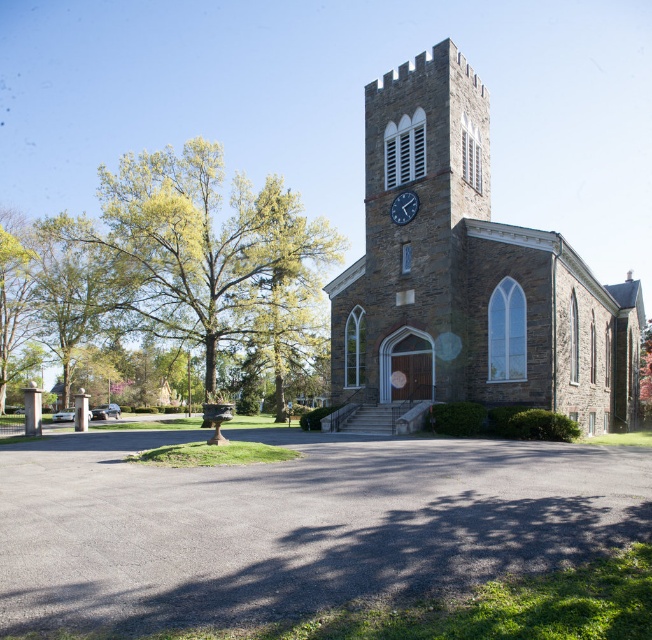
Is green leafy tree at left bigger than metallic clock at upper center?

Yes, green leafy tree at left is bigger than metallic clock at upper center.

Who is shorter, green leafy tree at left or metallic clock at upper center?

With less height is metallic clock at upper center.

The image size is (652, 640). Describe the element at coordinates (205, 253) in the screenshot. I see `green leafy tree at left` at that location.

Find the location of `green leafy tree at left`. green leafy tree at left is located at coordinates (205, 253).

Does stone church at center have a smaller size compared to green leafy tree at left?

Yes.

Is stone church at center shorter than green leafy tree at left?

Yes, stone church at center is shorter than green leafy tree at left.

What do you see at coordinates (469, 273) in the screenshot?
I see `stone church at center` at bounding box center [469, 273].

In order to click on stone church at center in this screenshot , I will do `click(469, 273)`.

Can you confirm if stone church at center is thinner than metallic clock at upper center?

No.

The image size is (652, 640). What do you see at coordinates (469, 273) in the screenshot?
I see `stone church at center` at bounding box center [469, 273].

Is point (561, 280) in front of point (404, 208)?

Yes, it is in front of point (404, 208).

At what (x,y) coordinates should I click in order to perform the action: click on stone church at center. Please return your answer as a coordinate pair (x, y). Looking at the image, I should click on (469, 273).